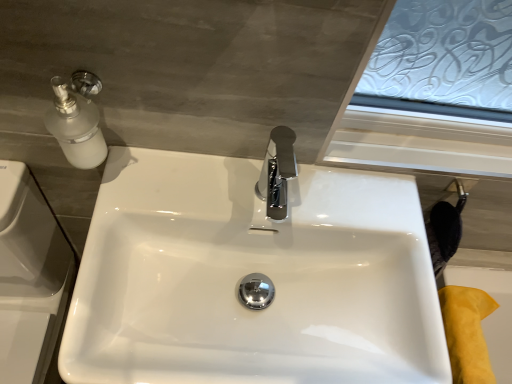
Question: Is yellow suede bath at lower right facing towards white glossy sink at center?

Choices:
 (A) yes
 (B) no

Answer: (B)

Question: Considering the relative positions of yellow suede bath at lower right and white glossy sink at center in the image provided, is yellow suede bath at lower right to the left of white glossy sink at center from the viewer's perspective?

Choices:
 (A) no
 (B) yes

Answer: (A)

Question: Is yellow suede bath at lower right oriented away from white glossy sink at center?

Choices:
 (A) yes
 (B) no

Answer: (B)

Question: Is yellow suede bath at lower right at the right side of white glossy sink at center?

Choices:
 (A) yes
 (B) no

Answer: (A)

Question: Is yellow suede bath at lower right bigger than white glossy sink at center?

Choices:
 (A) yes
 (B) no

Answer: (B)

Question: From a real-world perspective, is yellow suede bath at lower right physically above white glossy sink at center?

Choices:
 (A) no
 (B) yes

Answer: (A)

Question: From the image's perspective, is white glossy sink at center located above yellow suede bath at lower right?

Choices:
 (A) yes
 (B) no

Answer: (A)

Question: Considering the relative positions of white glossy sink at center and yellow suede bath at lower right in the image provided, is white glossy sink at center in front of yellow suede bath at lower right?

Choices:
 (A) yes
 (B) no

Answer: (A)

Question: Considering the relative positions of white glossy sink at center and yellow suede bath at lower right in the image provided, is white glossy sink at center to the right of yellow suede bath at lower right from the viewer's perspective?

Choices:
 (A) yes
 (B) no

Answer: (B)

Question: Is yellow suede bath at lower right located within white glossy sink at center?

Choices:
 (A) yes
 (B) no

Answer: (B)

Question: Does white glossy sink at center appear on the left side of yellow suede bath at lower right?

Choices:
 (A) yes
 (B) no

Answer: (A)

Question: Is white glossy sink at center far away from yellow suede bath at lower right?

Choices:
 (A) yes
 (B) no

Answer: (B)

Question: Is yellow suede bath at lower right bigger or smaller than white glossy sink at center?

Choices:
 (A) big
 (B) small

Answer: (B)